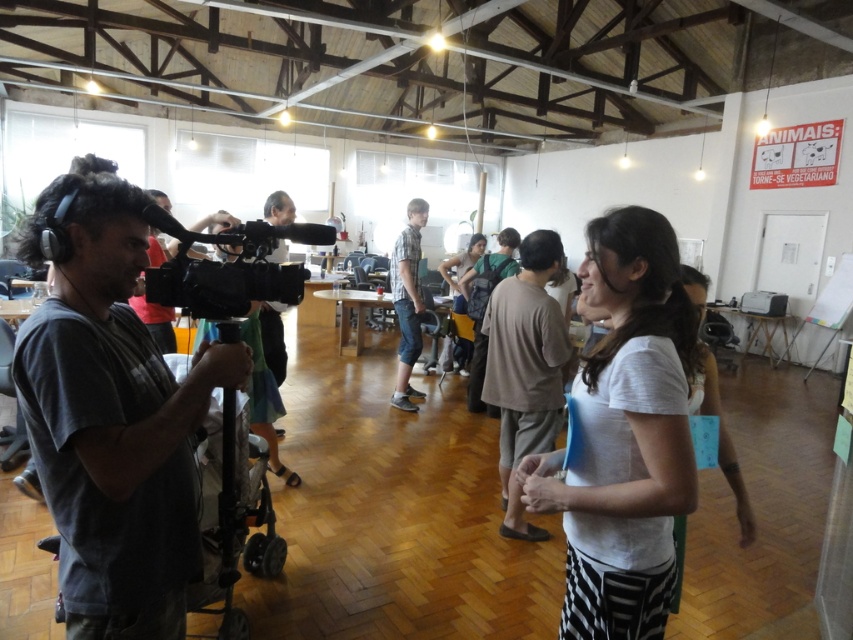
Question: Considering the relative positions of dark gray shirt at left and white cotton shirt at center in the image provided, where is dark gray shirt at left located with respect to white cotton shirt at center?

Choices:
 (A) below
 (B) above

Answer: (B)

Question: Is dark gray shirt at left below plaid cotton shirt at center?

Choices:
 (A) yes
 (B) no

Answer: (A)

Question: Does brown cotton shirt at center appear on the right side of plaid cotton shirt at center?

Choices:
 (A) yes
 (B) no

Answer: (A)

Question: Which of the following is the farthest from the observer?

Choices:
 (A) (660, 433)
 (B) (409, 356)

Answer: (B)

Question: Which point is closer to the camera?

Choices:
 (A) plaid cotton shirt at center
 (B) white cotton shirt at center
 (C) dark gray shirt at left
 (D) dark gray backpack at center

Answer: (C)

Question: Considering the real-world distances, which object is closest to the dark gray shirt at left?

Choices:
 (A) black plastic video camera at center
 (B) white cotton shirt at center
 (C) brown cotton shirt at center
 (D) dark gray backpack at center

Answer: (A)